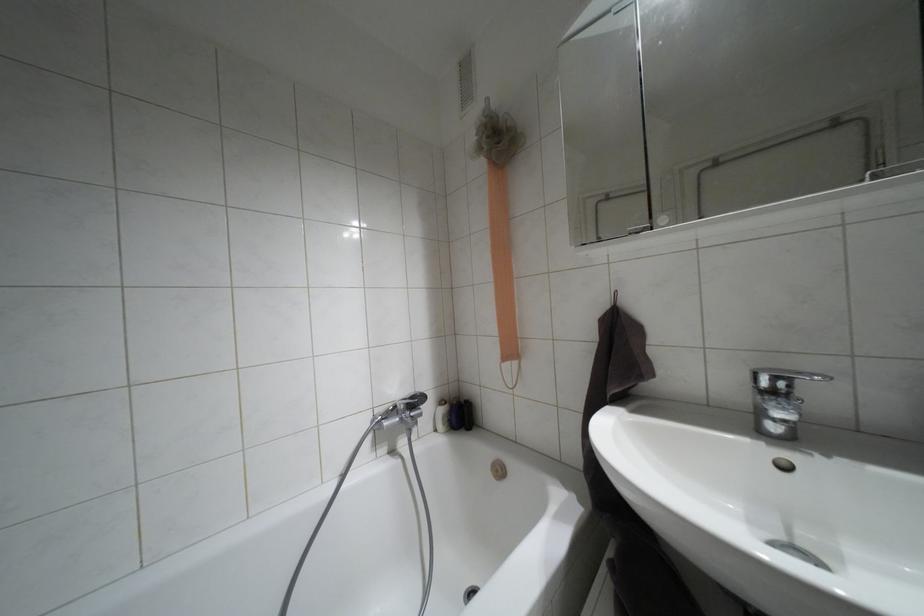
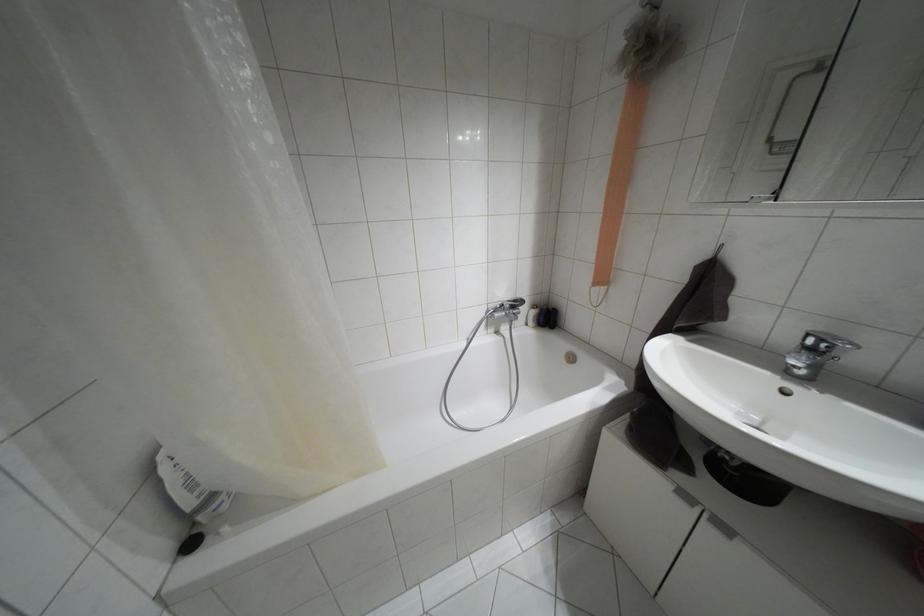
Locate, in the second image, the point that corresponds to point 460,415 in the first image.

(546, 317)